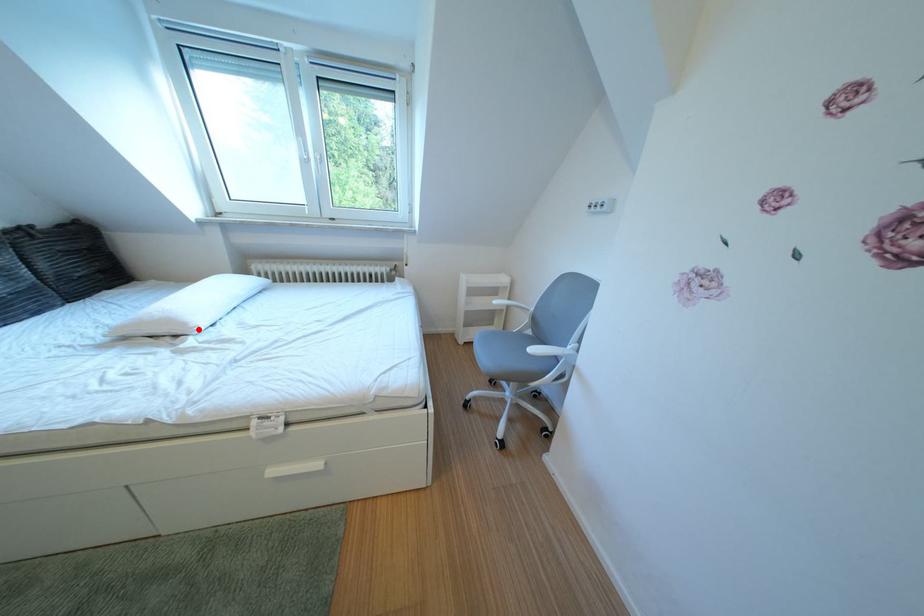
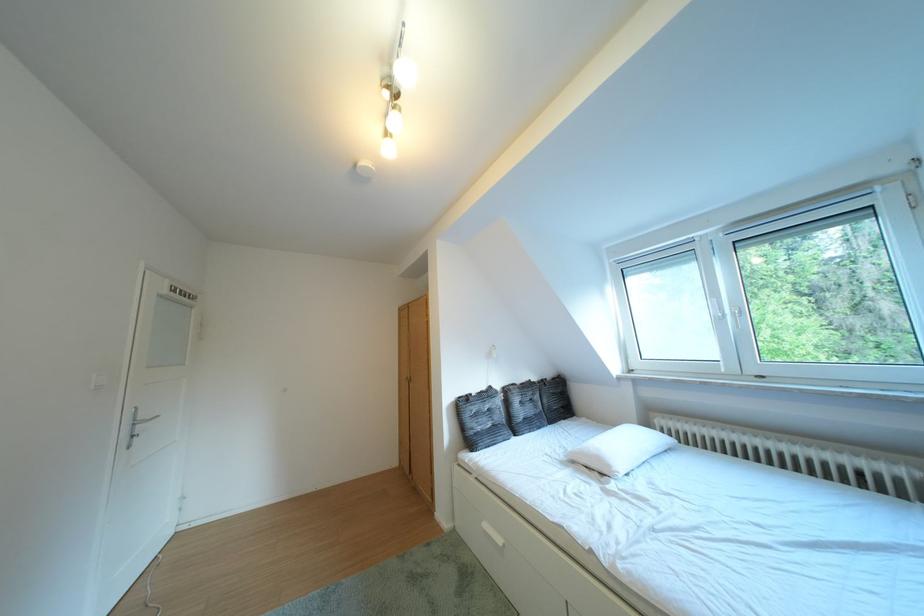
Question: I am providing you with two images of the same scene from different viewpoints. Given a red point in image1, look at the same physical point in image2. Is it:

Choices:
 (A) Closer to the viewpoint
 (B) Farther from the viewpoint

Answer: (B)